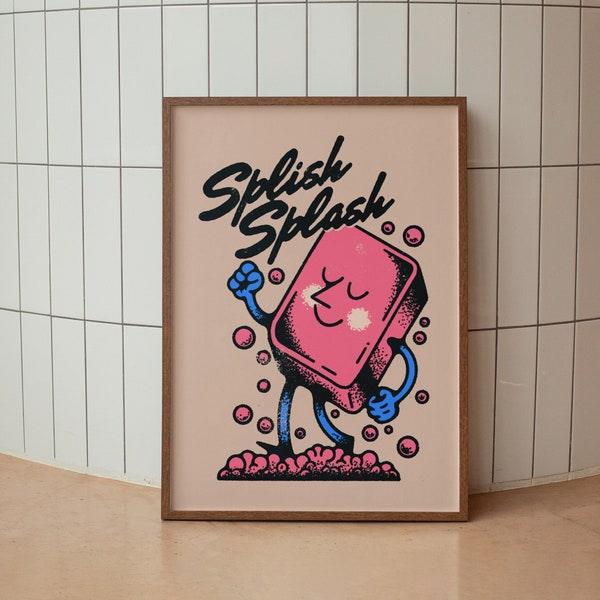
What are the coordinates of `floor` in the screenshot? It's located at (326, 573).